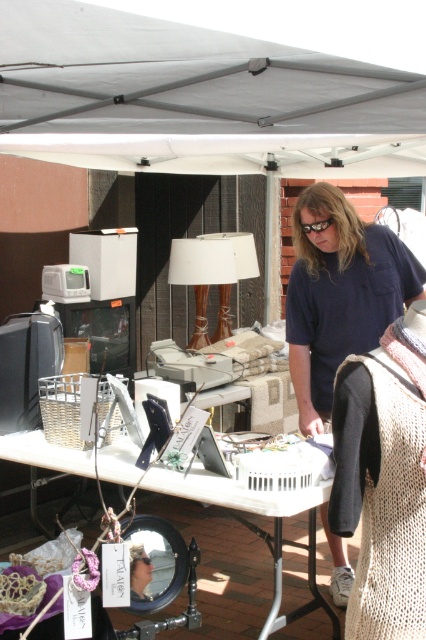
You are standing at the entrance of the flea market and want to locate the gray fabric canopy at upper center. According to the coordinates provided, where should you look relative to the center of the image?

The gray fabric canopy at upper center is located at coordinates 0.155 on the x axis and 0.460 on the y axis, which means it is positioned to the left and slightly above the center of the image.

You are a customer at the flea market and want to know if the gray fabric canopy at upper center can provide shade for the dark blue shirt at center. Based on their heights, can the canopy cover the shirt?

The gray fabric canopy at upper center is not as tall as the dark blue shirt at center, so it cannot provide shade for the shirt since it is shorter than the shirt.

From the picture: You are a customer at the flea market and want to pick up both the dark blue shirt at center and the metallic silver mirror at center. How far apart are these two items?

The dark blue shirt at center and the metallic silver mirror at center are 36.79 inches apart.